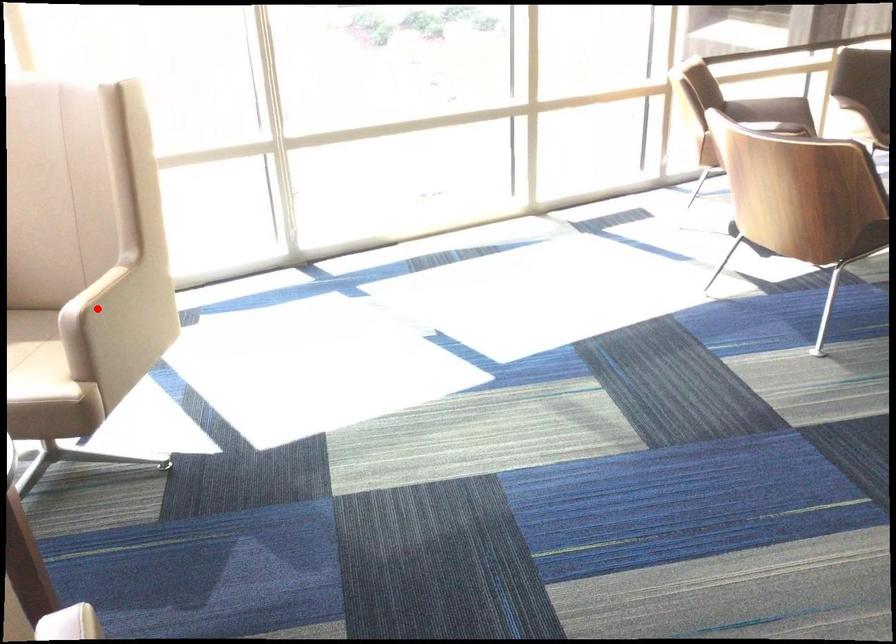
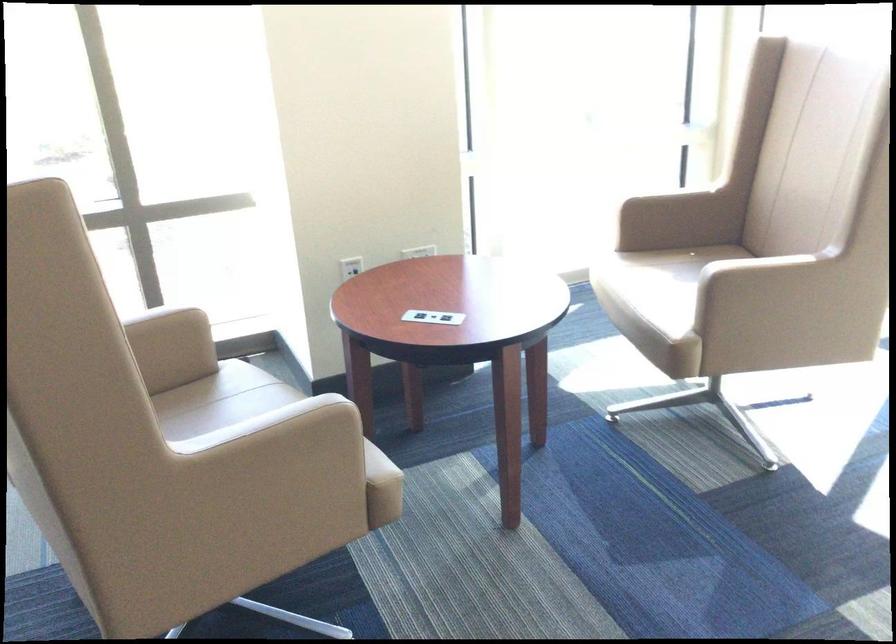
The point at the highlighted location is marked in the first image. Where is the corresponding point in the second image?

(744, 270)